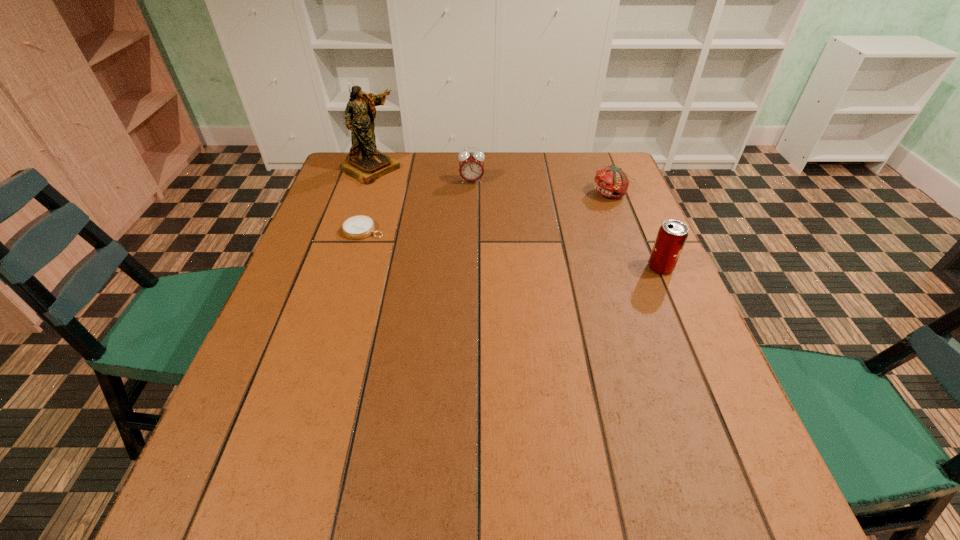
At what (x,y) coordinates should I click in order to perform the action: click on vacant area at the near left corner. Please return your answer as a coordinate pair (x, y). Looking at the image, I should click on (228, 454).

Locate an element on the screen. The height and width of the screenshot is (540, 960). vacant space at the near right corner is located at coordinates (654, 413).

Where is `empty location between the tomato and the third object from right to left`? empty location between the tomato and the third object from right to left is located at coordinates (540, 187).

Image resolution: width=960 pixels, height=540 pixels. Identify the location of vacant region between the figurine and the compass. (368, 199).

Where is `free spot between the figurine and the fourth tallest object`? free spot between the figurine and the fourth tallest object is located at coordinates (491, 181).

Locate an element on the screen. This screenshot has width=960, height=540. vacant area that lies between the tallest object and the nearest object is located at coordinates (516, 218).

The height and width of the screenshot is (540, 960). I want to click on free spot between the figurine and the third object from left to right, so click(421, 175).

You are a GUI agent. You are given a task and a screenshot of the screen. Output one action in this format:
    pyautogui.click(x=<x>, y=<y>)
    Task: Click on the unoccupied area between the shortest object and the figurine
    
    Given the screenshot: What is the action you would take?
    pyautogui.click(x=368, y=199)

Image resolution: width=960 pixels, height=540 pixels. Find the location of `vacant area that lies between the fourth tallest object and the nearest object`. vacant area that lies between the fourth tallest object and the nearest object is located at coordinates (636, 231).

Locate an element on the screen. The height and width of the screenshot is (540, 960). vacant point located between the nearest object and the alarm clock is located at coordinates (566, 225).